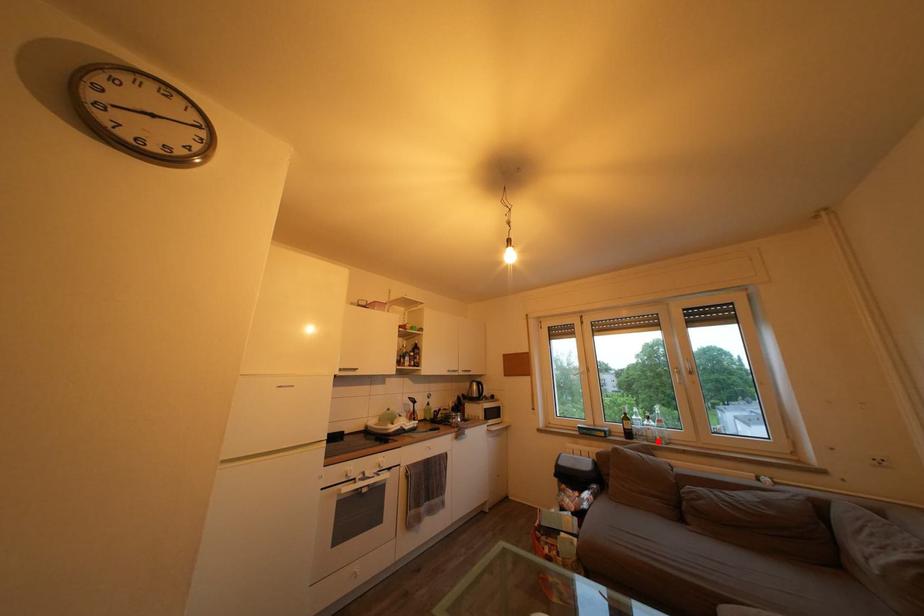
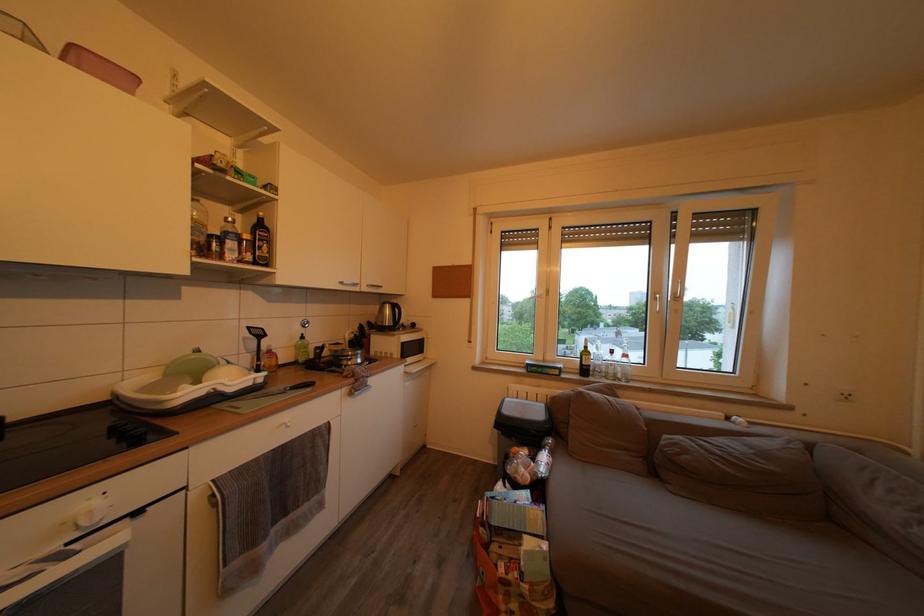
Question: I am providing you with two images of the same scene from different viewpoints. A red point is marked on the first image. At the location where the point appears in image 1, is it still visible in image 2?

Choices:
 (A) Yes
 (B) No

Answer: (A)